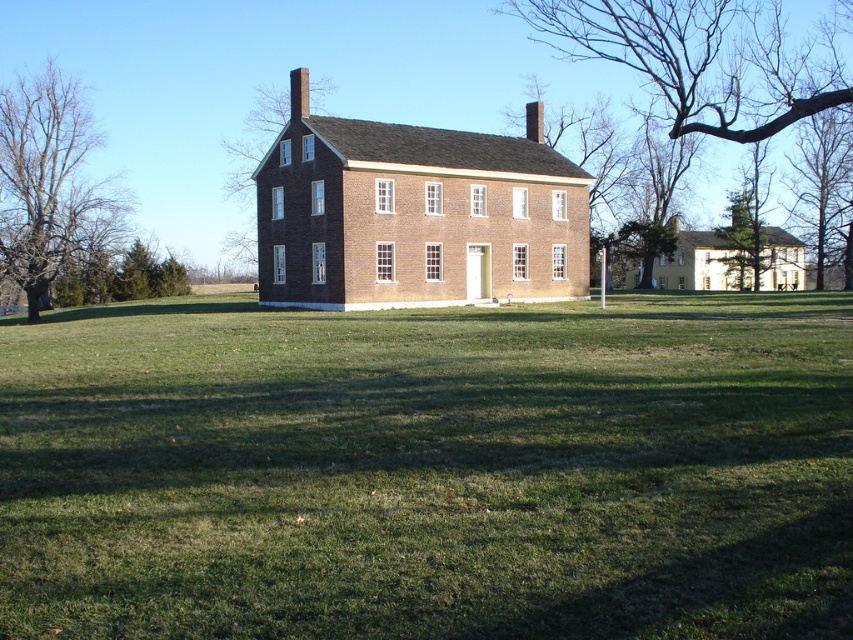
Question: Does bare branches at upper center have a lesser width compared to bare wood tree at left?

Choices:
 (A) yes
 (B) no

Answer: (B)

Question: Among these points, which one is nearest to the camera?

Choices:
 (A) (720, 86)
 (B) (26, 209)
 (C) (16, 593)
 (D) (834, 196)

Answer: (C)

Question: Among these objects, which one is nearest to the camera?

Choices:
 (A) bare wood tree at left
 (B) brown brick house at center
 (C) green grass at center
 (D) bare branches at upper right

Answer: (C)

Question: Can you confirm if green grass at center is positioned to the right of brown brick house at center?

Choices:
 (A) yes
 (B) no

Answer: (A)

Question: Is the position of green grass at center less distant than that of bare wood tree at left?

Choices:
 (A) yes
 (B) no

Answer: (A)

Question: Among these objects, which one is farthest from the camera?

Choices:
 (A) green grass at center
 (B) bare wood tree at left
 (C) bare branches at upper right
 (D) bare branches at upper center

Answer: (C)